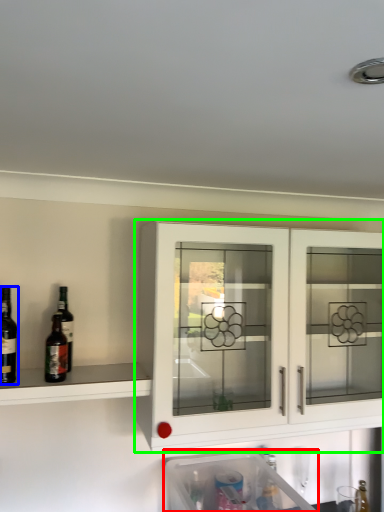
Question: Which is farther away from dish washer (highlighted by a red box)? wine (highlighted by a blue box) or cabinetry (highlighted by a green box)?

Choices:
 (A) wine
 (B) cabinetry

Answer: (A)